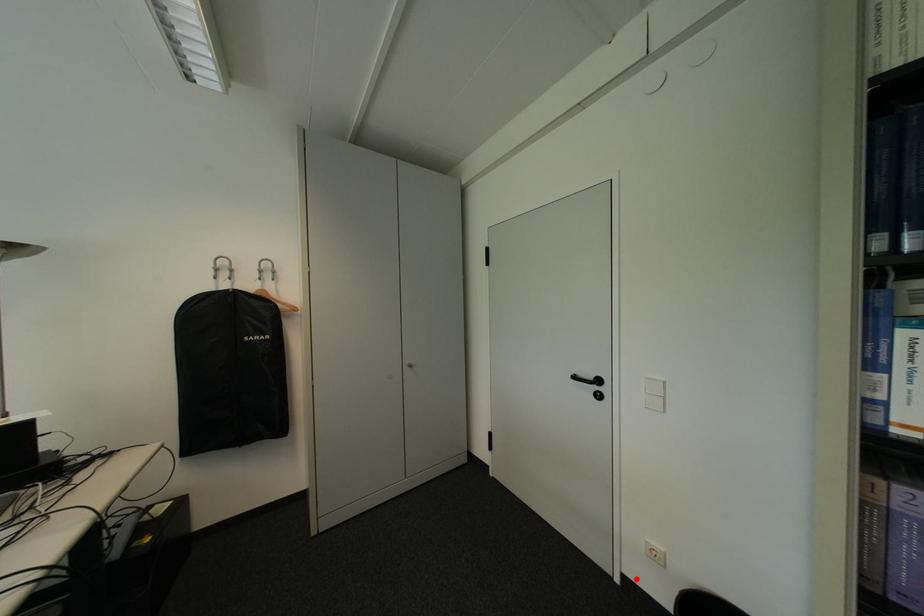
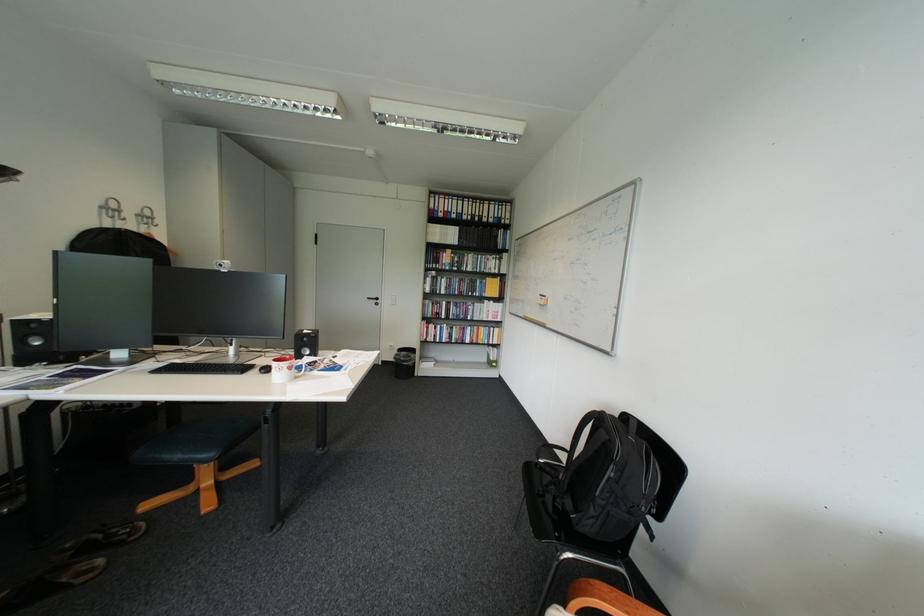
Question: A red point is marked in image1. In image2, is the corresponding 3D point closer to the camera or farther? Reply with the corresponding letter.

Choices:
 (A) The corresponding 3D point is closer.
 (B) The corresponding 3D point is farther.

Answer: (B)